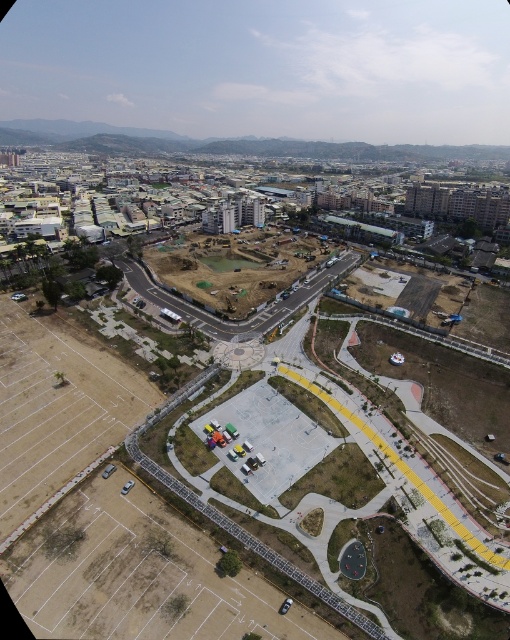
Is concrete asphalt race track at lower left bigger than brown dirt at center?

Correct, concrete asphalt race track at lower left is larger in size than brown dirt at center.

Does point (69, 611) lie in front of point (175, 308)?

That is True.

This screenshot has height=640, width=510. What are the coordinates of `concrete asphalt race track at lower left` in the screenshot? It's located at (130, 584).